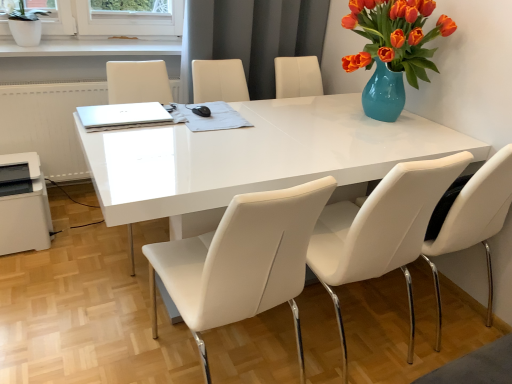
Identify the location of white leather chair at center, placed as the second chair when sorted from left to right. Image resolution: width=512 pixels, height=384 pixels. (381, 231).

Measure the distance between point (x=161, y=102) and camera.

The distance of point (x=161, y=102) from camera is 7.38 feet.

What is the approximate width of gray fabric curtain at upper center?

gray fabric curtain at upper center is 11.62 inches in width.

Find the location of a particular element. Image resolution: width=512 pixels, height=384 pixels. gray fabric curtain at upper center is located at coordinates (251, 37).

Describe the element at coordinates (475, 219) in the screenshot. I see `white leather chair at right, placed as the third chair when sorted from left to right` at that location.

Where is `white leather chair at center, arranged as the first chair when viewed from the left`? This screenshot has height=384, width=512. white leather chair at center, arranged as the first chair when viewed from the left is located at coordinates (242, 262).

What do you see at coordinates (242, 262) in the screenshot? I see `white leather chair at center, arranged as the first chair when viewed from the left` at bounding box center [242, 262].

Describe the element at coordinates (338, 218) in the screenshot. I see `white leather chair at center` at that location.

Measure the distance between white plastic printer at lower left and camera.

white plastic printer at lower left is 2.04 meters from camera.

Find the location of a particular element. The height and width of the screenshot is (384, 512). white leather chair at center, placed as the second chair when sorted from left to right is located at coordinates (x=381, y=231).

Relative to white leather chair at right, placed as the third chair when sorted from left to right, is white leather chair at center, positioned as the 3th chair in right-to-left order, in front or behind?

white leather chair at center, positioned as the 3th chair in right-to-left order, is positioned closer to the viewer than white leather chair at right, placed as the third chair when sorted from left to right.

How many degrees apart are the facing directions of white leather chair at center, positioned as the 3th chair in right-to-left order, and white leather chair at right, placed as the 1th chair when sorted from right to left?

They differ by 0.967 degrees in their facing directions.

From the image's perspective, which chair is the 2nd one below the white leather chair at right, placed as the third chair when sorted from left to right? Please provide its 2D coordinates.

[(242, 262)]

Looking at this image, in the image, is white leather chair at center positioned in front of or behind white leather chair at center, positioned as the 3th chair in right-to-left order?

Visually, white leather chair at center is located behind white leather chair at center, positioned as the 3th chair in right-to-left order.

What are the coordinates of `trio below the white leather chair at center, positioned as the 3th chair in right-to-left order (from a real-world perspective)` in the screenshot? It's located at (338, 218).

Is point (338, 321) closer to viewer compared to point (298, 249)?

No.

Considering the relative sizes of white plastic printer at lower left and white leather chair at center, positioned as the 3th chair in right-to-left order, in the image provided, is white plastic printer at lower left wider than white leather chair at center, positioned as the 3th chair in right-to-left order,?

Incorrect, the width of white plastic printer at lower left does not surpass that of white leather chair at center, positioned as the 3th chair in right-to-left order.

Which is more to the right, white plastic printer at lower left or white leather chair at center, arranged as the first chair when viewed from the left?

From the viewer's perspective, white leather chair at center, arranged as the first chair when viewed from the left, appears more on the right side.

Is white plastic printer at lower left not close to white leather chair at center, positioned as the 3th chair in right-to-left order?

Yes.

What's the angular difference between white leather chair at center, arranged as the first chair when viewed from the left, and white leather chair at center, placed as the 2th chair when sorted from right to left,'s facing directions?

0.00148 degrees separate the facing orientations of white leather chair at center, arranged as the first chair when viewed from the left, and white leather chair at center, placed as the 2th chair when sorted from right to left.

Is white leather chair at center, arranged as the first chair when viewed from the left, beside white leather chair at center, placed as the second chair when sorted from left to right?

No, white leather chair at center, arranged as the first chair when viewed from the left, is not with white leather chair at center, placed as the second chair when sorted from left to right.

Is white leather chair at center, positioned as the 3th chair in right-to-left order, positioned with its back to white leather chair at center, placed as the second chair when sorted from left to right?

No, white leather chair at center, positioned as the 3th chair in right-to-left order, is not facing away from white leather chair at center, placed as the second chair when sorted from left to right.

Which object is thinner, white leather chair at center, positioned as the 3th chair in right-to-left order, or white leather chair at center, placed as the 2th chair when sorted from right to left?

Thinner between the two is white leather chair at center, placed as the 2th chair when sorted from right to left.

Is white leather chair at center far away from gray fabric curtain at upper center?

Yes, white leather chair at center is far from gray fabric curtain at upper center.

Consider the image. Which is behind, white leather chair at center or gray fabric curtain at upper center?

gray fabric curtain at upper center is further away from the camera.

Considering the relative sizes of white leather chair at center and gray fabric curtain at upper center in the image provided, is white leather chair at center bigger than gray fabric curtain at upper center?

No, white leather chair at center is not bigger than gray fabric curtain at upper center.

From the image's perspective, is white leather chair at center above gray fabric curtain at upper center?

Incorrect, from the image's perspective, white leather chair at center is lower than gray fabric curtain at upper center.

Which is further, (499,202) or (127,89)?

Positioned behind is point (127,89).

From the white leather chair at center, count 3rd chair to the right and point to it. Please provide its 2D coordinates.

[(475, 219)]

Is white leather chair at right, placed as the third chair when sorted from left to right, oriented towards white leather chair at center?

No, white leather chair at right, placed as the third chair when sorted from left to right, is not aimed at white leather chair at center.

Can you confirm if white leather chair at right, placed as the third chair when sorted from left to right, is positioned to the left of white leather chair at center?

Incorrect, white leather chair at right, placed as the third chair when sorted from left to right, is not on the left side of white leather chair at center.

From a real-world perspective, who is located higher, white leather chair at center or gray fabric curtain at upper center?

gray fabric curtain at upper center is physically above.

From the image's perspective, is white leather chair at center beneath gray fabric curtain at upper center?

Correct, white leather chair at center appears lower than gray fabric curtain at upper center in the image.

How far apart are white leather chair at center and gray fabric curtain at upper center?

white leather chair at center is 23.01 inches from gray fabric curtain at upper center.

Is white leather chair at center wider or thinner than gray fabric curtain at upper center?

Considering their sizes, white leather chair at center looks broader than gray fabric curtain at upper center.

The image size is (512, 384). I want to click on the 2nd chair above the white leather chair at center, arranged as the first chair when viewed from the left (from a real-world perspective), so click(x=475, y=219).

Identify the location of trio that is on the left side of white leather chair at center, positioned as the 3th chair in right-to-left order. (338, 218).

Considering their positions, is white leather chair at center, placed as the 2th chair when sorted from right to left, positioned closer to white leather chair at center, arranged as the first chair when viewed from the left, than silver metallic laptop at upper left?

white leather chair at center, placed as the 2th chair when sorted from right to left, is positioned closer to the anchor white leather chair at center, arranged as the first chair when viewed from the left.

When comparing their distances from white leather chair at right, placed as the 1th chair when sorted from right to left, does white plastic printer at lower left or white leather chair at center seem closer?

Based on the image, white leather chair at center appears to be nearer to white leather chair at right, placed as the 1th chair when sorted from right to left.

Looking at the image, which one is located closer to white leather chair at right, placed as the 1th chair when sorted from right to left, white leather chair at center, placed as the 2th chair when sorted from right to left, or silver metallic laptop at upper left?

white leather chair at center, placed as the 2th chair when sorted from right to left.

From the image, which object appears to be farther from silver metallic laptop at upper left, white leather chair at center or white leather chair at center, placed as the 2th chair when sorted from right to left?

white leather chair at center is positioned further to the anchor silver metallic laptop at upper left.

In the scene shown: Estimate the real-world distances between objects in this image. Which object is further from gray fabric curtain at upper center, white leather chair at center or white leather chair at center, arranged as the first chair when viewed from the left?

Among the two, white leather chair at center, arranged as the first chair when viewed from the left, is located further to gray fabric curtain at upper center.

Looking at the image, which one is located closer to white leather chair at center, white leather chair at center or white leather chair at center, placed as the second chair when sorted from left to right?

white leather chair at center, placed as the second chair when sorted from left to right.

Estimate the real-world distances between objects in this image. Which object is closer to white plastic printer at lower left, white leather chair at right, placed as the third chair when sorted from left to right, or white leather chair at center, placed as the second chair when sorted from left to right?

Based on the image, white leather chair at center, placed as the second chair when sorted from left to right, appears to be nearer to white plastic printer at lower left.

Looking at this image, from the image, which object appears to be farther from white leather chair at right, placed as the third chair when sorted from left to right, white leather chair at center or white leather chair at center, arranged as the first chair when viewed from the left?

white leather chair at center, arranged as the first chair when viewed from the left, lies further to white leather chair at right, placed as the third chair when sorted from left to right, than the other object.

Identify the location of armchair between white plastic printer at lower left and white leather chair at center, arranged as the first chair when viewed from the left, from left to right. This screenshot has width=512, height=384. (138, 82).

Locate an element on the screen. The width and height of the screenshot is (512, 384). houseplant situated between white plastic printer at lower left and white leather chair at center, arranged as the first chair when viewed from the left, from left to right is located at coordinates (24, 22).

Where is `laptop between white leather chair at center, arranged as the first chair when viewed from the left, and white ceramic pot at upper left in the front-back direction`? laptop between white leather chair at center, arranged as the first chair when viewed from the left, and white ceramic pot at upper left in the front-back direction is located at coordinates (122, 114).

Find the location of a particular element. This screenshot has height=384, width=512. laptop between white ceramic pot at upper left and white leather chair at center in the up-down direction is located at coordinates (122, 114).